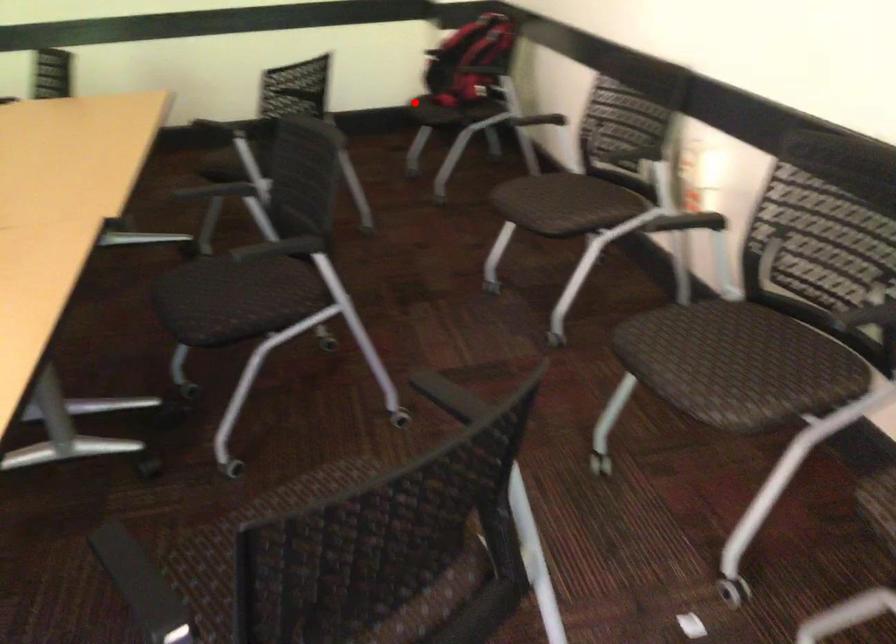
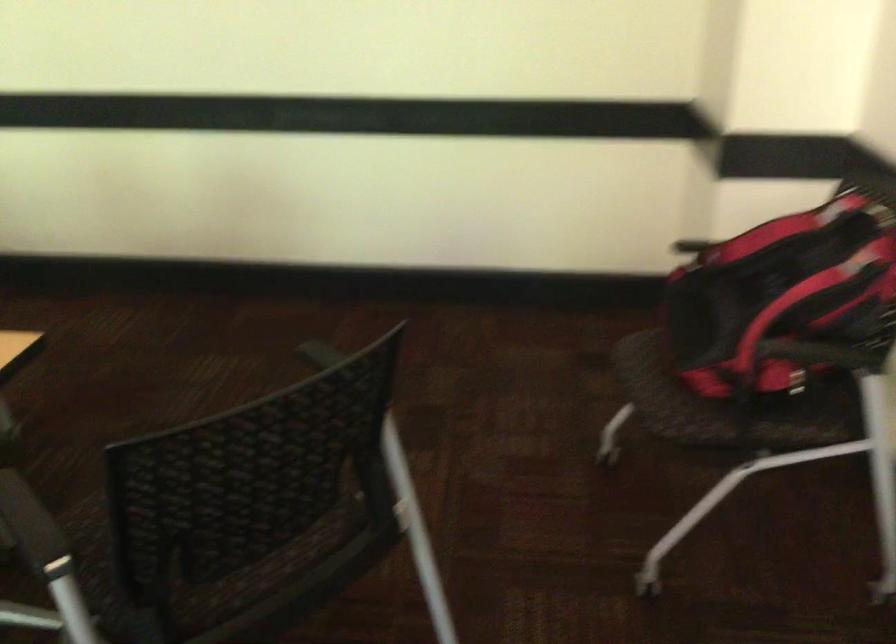
Where in the second image is the point corresponding to the highlighted location from the first image?

(647, 395)